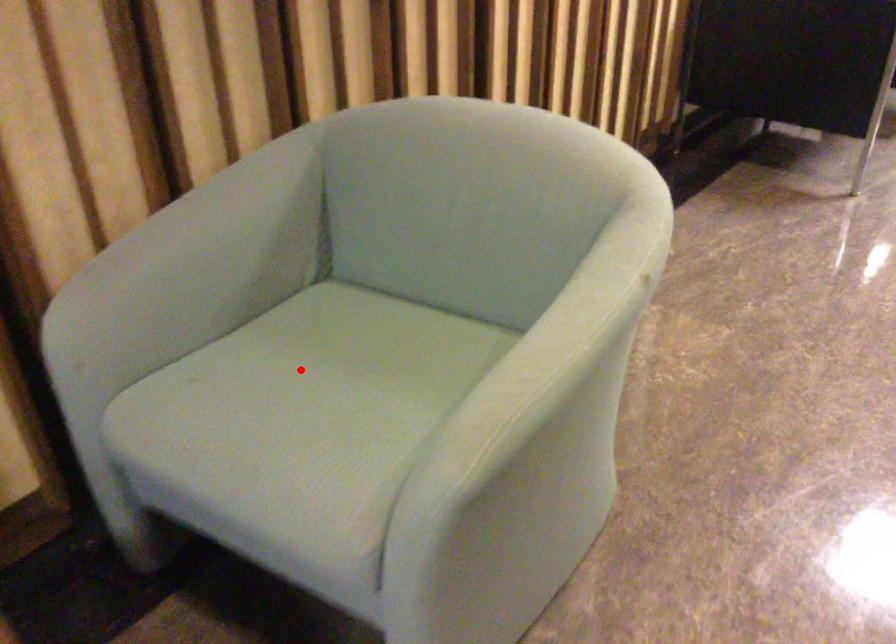
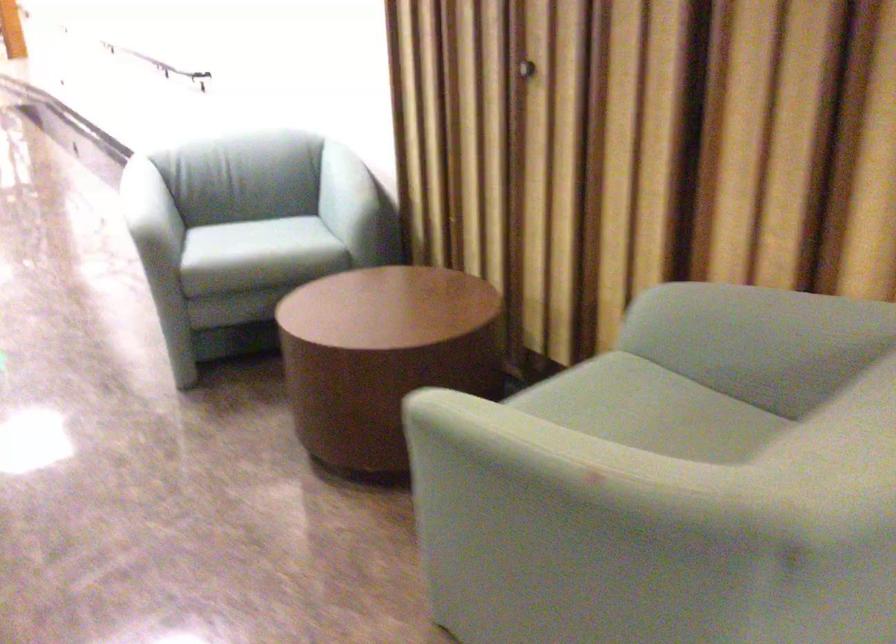
Locate, in the second image, the point that corresponds to the highlighted location in the first image.

(650, 410)